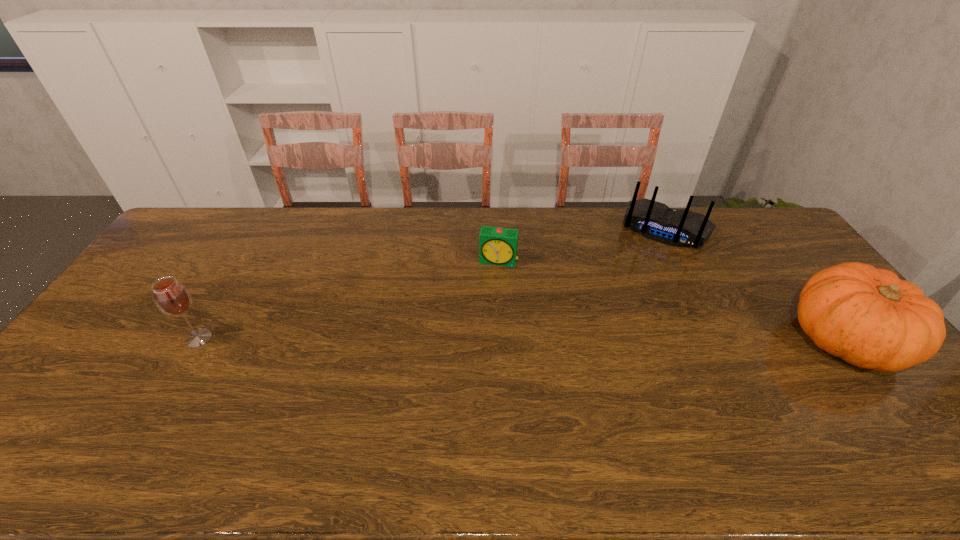
Find the location of a particular element. This screenshot has width=960, height=540. free location located on the front-facing side of the third object from right to left is located at coordinates (473, 366).

The image size is (960, 540). Identify the location of vacant area situated on the front-facing side of the third object from right to left. (480, 334).

This screenshot has width=960, height=540. Find the location of `free space located 0.300m on the front-facing side of the third object from right to left`. free space located 0.300m on the front-facing side of the third object from right to left is located at coordinates (480, 337).

You are a GUI agent. You are given a task and a screenshot of the screen. Output one action in this format:
    pyautogui.click(x=<x>, y=<y>)
    Task: Click on the object at the far edge
    The image size is (960, 540).
    Given the screenshot: What is the action you would take?
    pyautogui.click(x=656, y=221)

What are the coordinates of `object that is at the right edge` in the screenshot? It's located at pos(868,317).

At what (x,y) coordinates should I click in order to perform the action: click on blank space at the far edge of the desktop. Please return your answer as a coordinate pair (x, y). This screenshot has width=960, height=540. Looking at the image, I should click on (319, 214).

Where is `free point at the near edge`? This screenshot has height=540, width=960. free point at the near edge is located at coordinates point(228,398).

Locate an element on the screen. The height and width of the screenshot is (540, 960). vacant space at the left edge of the desktop is located at coordinates (173, 261).

Where is `vacant space at the right edge of the desktop`? This screenshot has height=540, width=960. vacant space at the right edge of the desktop is located at coordinates (901, 376).

I want to click on unoccupied area between the pumpkin and the router, so click(756, 285).